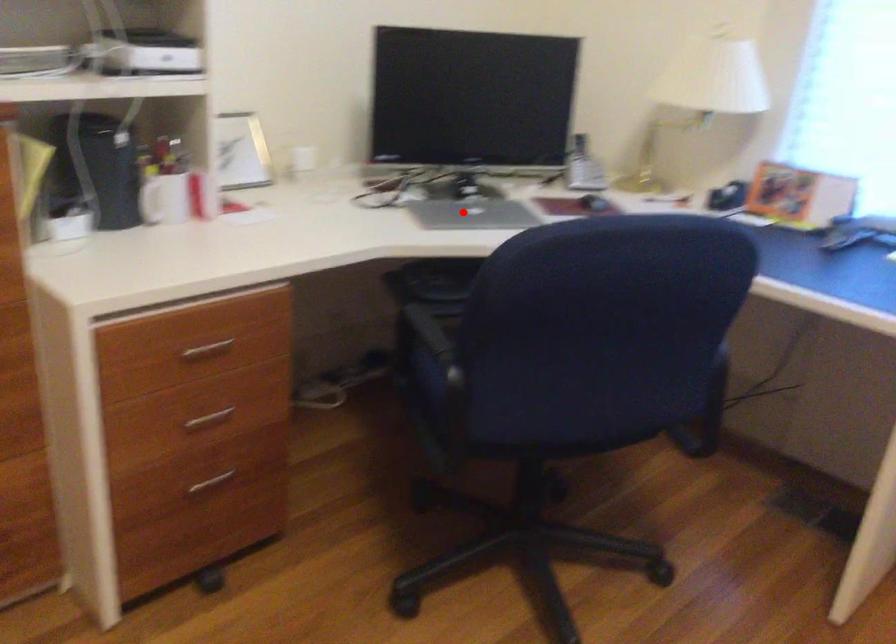
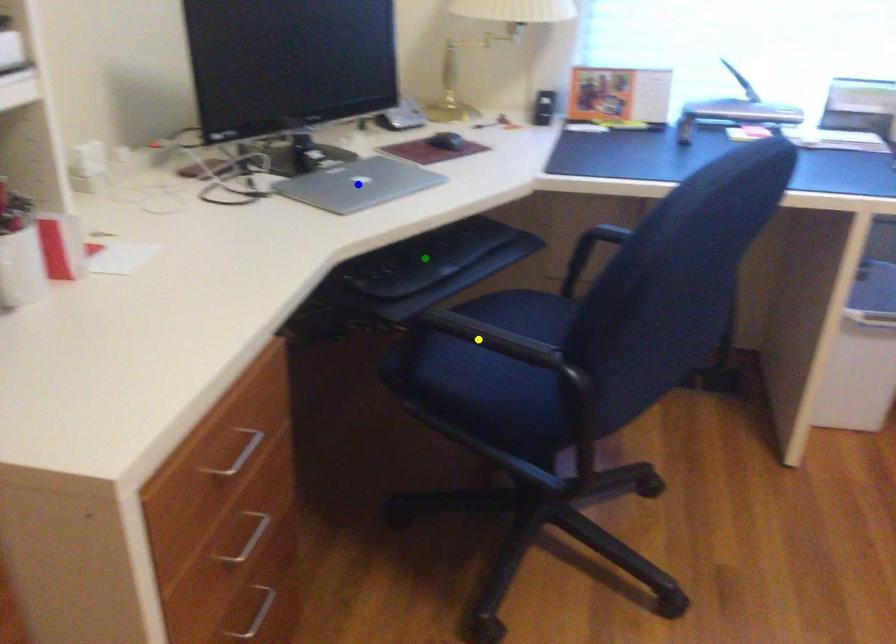
Question: I am providing you with two images of the same scene from different viewpoints. A red point is marked on the first image. You are given multiple points on the second image. Which point in image 2 represents the same 3d spot as the red point in image 1?

Choices:
 (A) green point
 (B) blue point
 (C) yellow point

Answer: (B)